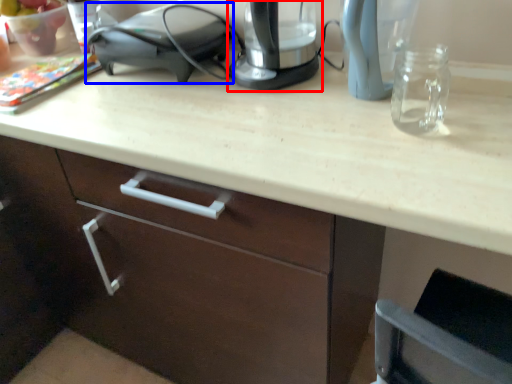
Question: Among these objects, which one is farthest to the camera, home appliance (highlighted by a red box) or appliance (highlighted by a blue box)?

Choices:
 (A) home appliance
 (B) appliance

Answer: (B)